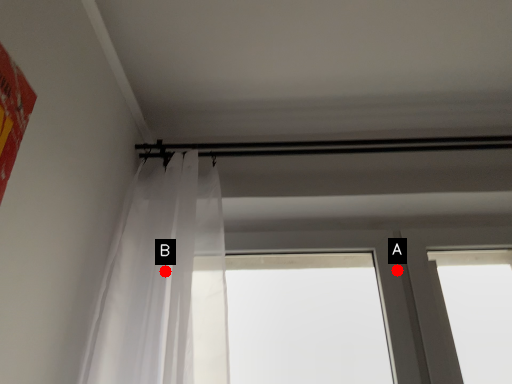
Question: Two points are circled on the image, labeled by A and B beside each circle. Which point appears farthest from the camera in this image?

Choices:
 (A) A is further
 (B) B is further

Answer: (A)